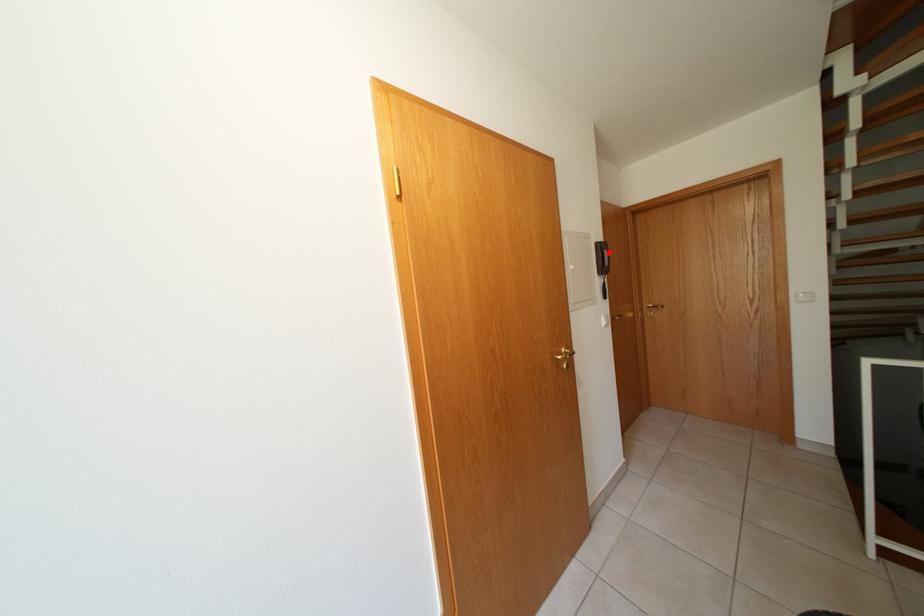
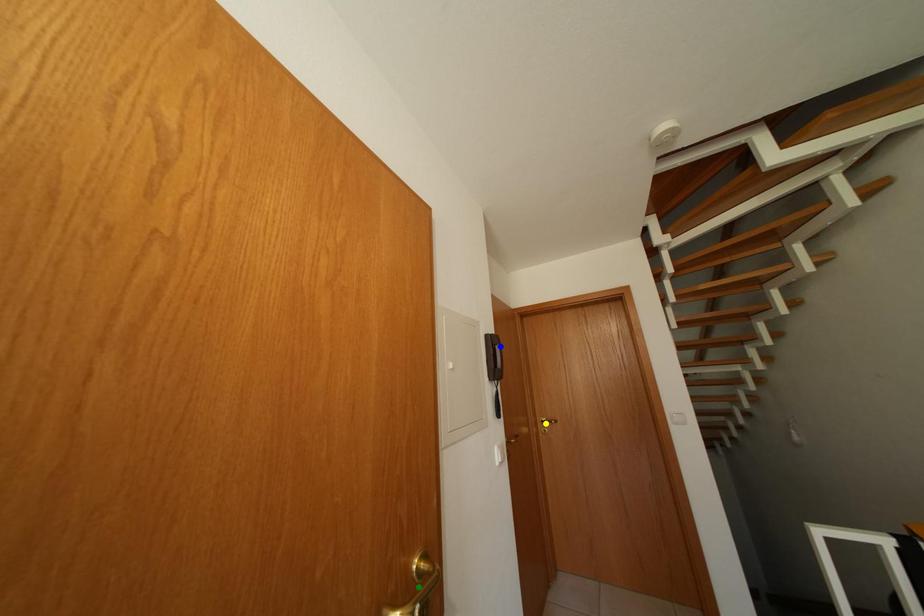
Question: I am providing you with two images of the same scene from different viewpoints. A red point is marked on the first image. You are given multiple points on the second image. Which mark in image 2 goes with the point in image 1?

Choices:
 (A) green point
 (B) yellow point
 (C) blue point

Answer: (C)